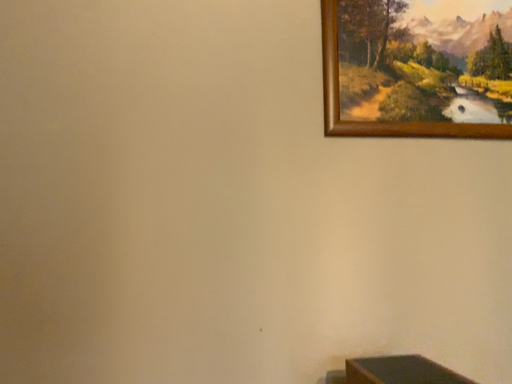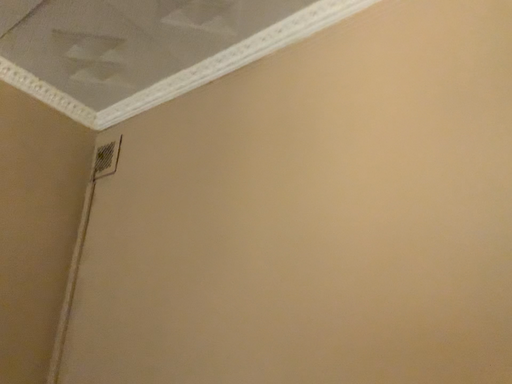
Question: Which way did the camera rotate in the video?

Choices:
 (A) rotated left
 (B) rotated right

Answer: (A)